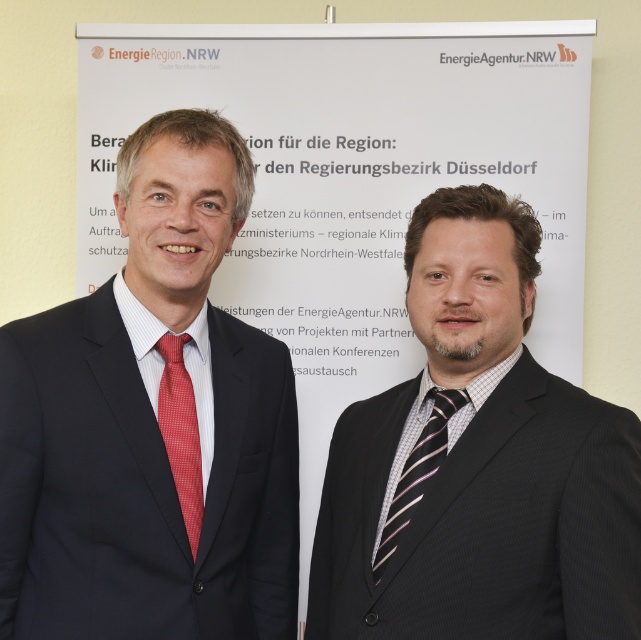
You are attending an event and see two people in dark suits. The person on the right has a striped fabric suit at right and a striped silk tie at right. Which item is positioned higher on their body?

The striped fabric suit at right is located above the striped silk tie at right, so the striped fabric suit at right is positioned higher on their body.

You are organizing a formal event and need to ensure that all attendees have ties that meet specific width requirements. You have two ties available for selection. The red checkered tie at left and the striped silk tie at right. Which tie should you choose if you need a wider tie for the event?

The striped silk tie at right has a greater width compared to the red checkered tie at left, so you should choose the striped silk tie at right for the event.